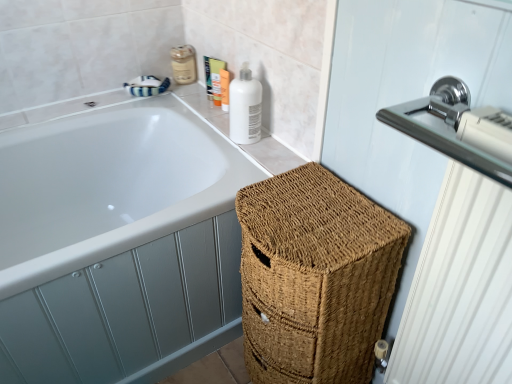
Find the location of a particular element. The height and width of the screenshot is (384, 512). free space on the front side of white glossy bottle at upper right is located at coordinates (265, 150).